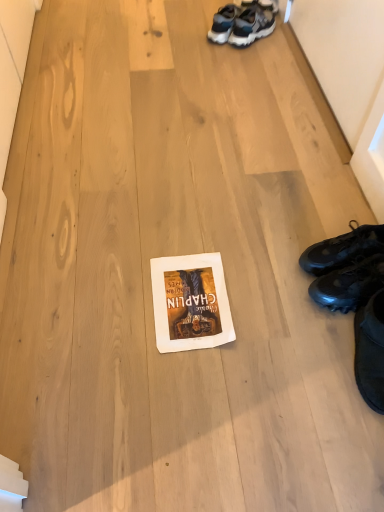
Where is `vacant area on top of white paper at center (from a real-world perspective)`? vacant area on top of white paper at center (from a real-world perspective) is located at coordinates (181, 295).